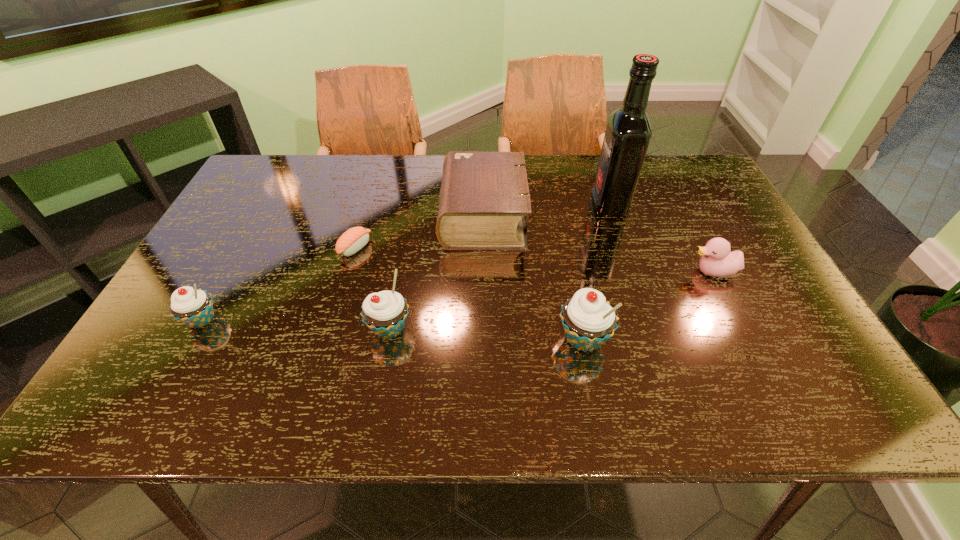
In the image, there is a desktop. Where is `free region at the near edge`? free region at the near edge is located at coordinates (717, 367).

At what (x,y) coordinates should I click in order to perform the action: click on free space at the left edge of the desktop. Please return your answer as a coordinate pair (x, y). This screenshot has height=540, width=960. Looking at the image, I should click on (175, 323).

The height and width of the screenshot is (540, 960). Identify the location of free space at the right edge of the desktop. (737, 300).

The image size is (960, 540). In the image, there is a desktop. In order to click on vacant space at the far left corner in this screenshot , I will do `click(298, 172)`.

Locate an element on the screen. vacant region at the near right corner of the desktop is located at coordinates (x=822, y=358).

Image resolution: width=960 pixels, height=540 pixels. In order to click on free space between the shortest cupcake and the fourth object from left to right in this screenshot , I will do `click(343, 268)`.

Image resolution: width=960 pixels, height=540 pixels. Find the location of `free space that is in between the leftmost object and the sushi`. free space that is in between the leftmost object and the sushi is located at coordinates (278, 284).

At what (x,y) coordinates should I click in order to perform the action: click on free space that is in between the Bible and the liquor. Please return your answer as a coordinate pair (x, y). Looking at the image, I should click on (546, 211).

Identify the location of empty space that is in between the rightmost cupcake and the sixth object from right to left. Image resolution: width=960 pixels, height=540 pixels. (x=469, y=293).

Where is `free point between the third object from right to left and the Bible`? The width and height of the screenshot is (960, 540). free point between the third object from right to left and the Bible is located at coordinates (533, 278).